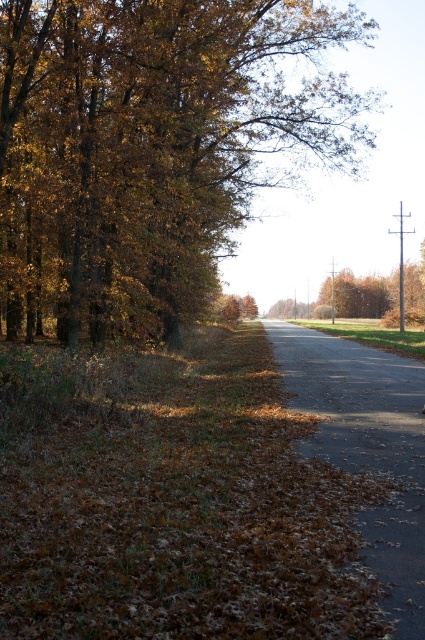
Can you confirm if brown leafy tree at left is positioned to the right of gravel road at center?

Indeed, brown leafy tree at left is positioned on the right side of gravel road at center.

Between brown leafy tree at left and gravel road at center, which one appears on the left side from the viewer's perspective?

From the viewer's perspective, gravel road at center appears more on the left side.

The width and height of the screenshot is (425, 640). In order to click on brown leafy tree at left in this screenshot , I will do `click(150, 147)`.